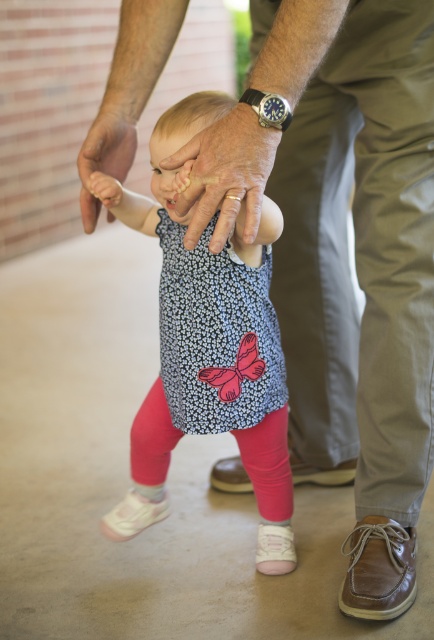
Looking at the scene, which object is positioned higher up between the matte skin hand at center and the white fabric shoe at lower center?

The matte skin hand at center is taller than the white fabric shoe at lower center.

You are a photographer standing at the camera position. You want to take a photo of the scene. The focus point is at point (243, 452). If your camera has a depth of field that can clearly capture objects within 4 feet from the focus point, will the adult and child in the scene be in focus?

The distance between the focus point at point (243, 452) and the camera is 5.01 feet. Since the depth of field can only clearly capture objects within 4 feet from the focus point, the adult and child will not be in focus as they are beyond the 4 feet range.

You are a shoe size measurement assistant. You need to determine which of the two brown leather shoes in the image is more suitable for a child. The brown leather shoe at lower right and the brown leather shoe at lower center are both visible. Based on their sizes, which one is more appropriate for a child?

The brown leather shoe at lower center is more appropriate for a child since it has a smaller size compared to the brown leather shoe at lower right.